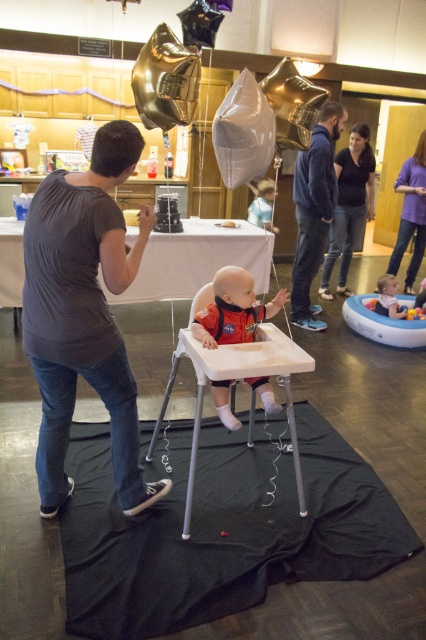
Question: Which point is closer to the camera taking this photo?

Choices:
 (A) (127, 147)
 (B) (296, 278)

Answer: (A)

Question: Which point is closer to the camera taking this photo?

Choices:
 (A) (417, 252)
 (B) (363, 328)

Answer: (B)

Question: Can you confirm if transparent plastic balloon at center is wider than black smooth shirt at upper center?

Choices:
 (A) no
 (B) yes

Answer: (A)

Question: Which point is farther to the camera?

Choices:
 (A) (307, 262)
 (B) (198, 433)
 (C) (356, 136)

Answer: (C)

Question: Is black fabric mat at center bigger than dark gray t-shirt at left?

Choices:
 (A) no
 (B) yes

Answer: (B)

Question: Is white plastic highchair at center above transparent plastic balloon at center?

Choices:
 (A) no
 (B) yes

Answer: (A)